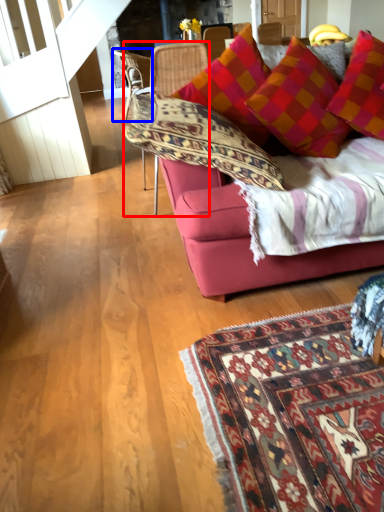
Question: Which object appears closest to the camera in this image, chair (highlighted by a red box) or chair (highlighted by a blue box)?

Choices:
 (A) chair
 (B) chair

Answer: (A)